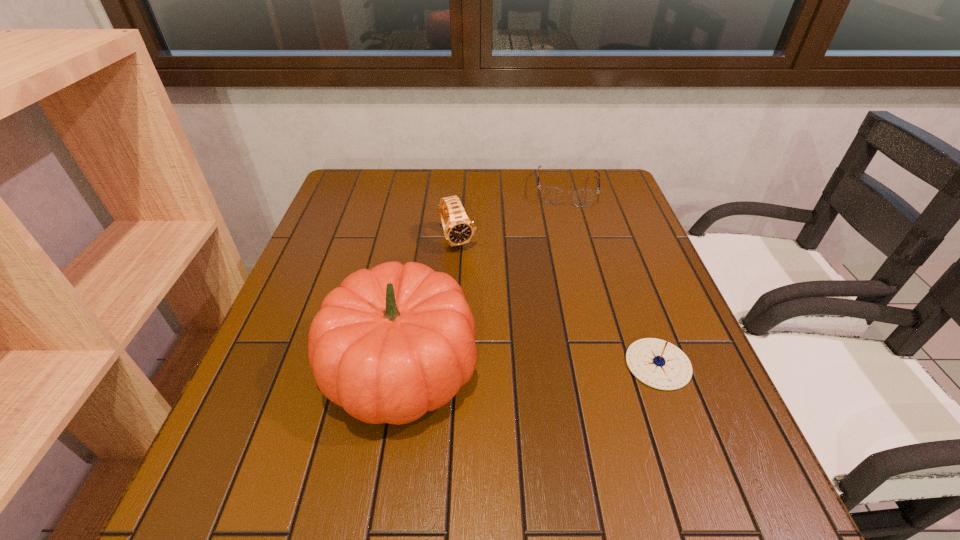
This screenshot has width=960, height=540. I want to click on free space located 0.260m on the front-facing side of the spectacles, so pos(565,264).

The width and height of the screenshot is (960, 540). Identify the location of free space located 0.330m on the front-facing side of the spectacles. (565, 282).

This screenshot has height=540, width=960. In order to click on vacant space located 0.300m on the front-facing side of the spectacles in this screenshot , I will do `click(565, 274)`.

Find the location of a particular element. The image size is (960, 540). object located in the far edge section of the desktop is located at coordinates (551, 195).

Where is `object present at the near edge`? The width and height of the screenshot is (960, 540). object present at the near edge is located at coordinates (391, 343).

The height and width of the screenshot is (540, 960). I want to click on object present at the left edge, so click(x=391, y=343).

This screenshot has width=960, height=540. I want to click on compass situated at the right edge, so click(x=657, y=363).

At what (x,y) coordinates should I click in order to perform the action: click on spectacles that is at the right edge. Please return your answer as a coordinate pair (x, y). The height and width of the screenshot is (540, 960). Looking at the image, I should click on (551, 195).

Locate an element on the screen. This screenshot has width=960, height=540. object located at the near left corner is located at coordinates (391, 343).

At what (x,y) coordinates should I click in order to perform the action: click on object present at the far right corner. Please return your answer as a coordinate pair (x, y). This screenshot has height=540, width=960. Looking at the image, I should click on (551, 195).